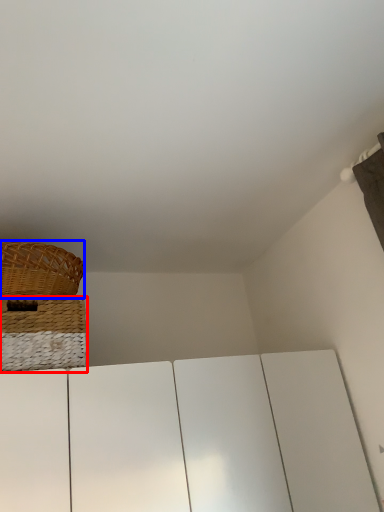
Question: Which object appears closest to the camera in this image, basket (highlighted by a red box) or picnic basket (highlighted by a blue box)?

Choices:
 (A) basket
 (B) picnic basket

Answer: (A)